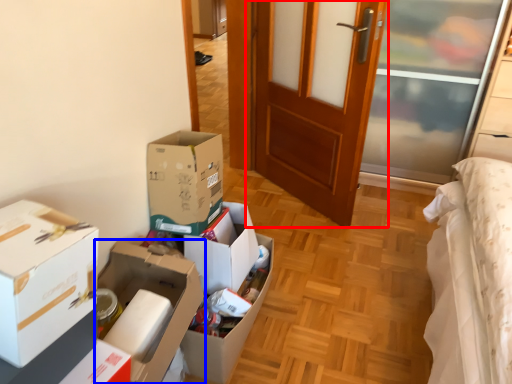
Question: Which of the following is the closest to the observer, door (highlighted by a red box) or box (highlighted by a blue box)?

Choices:
 (A) door
 (B) box

Answer: (B)